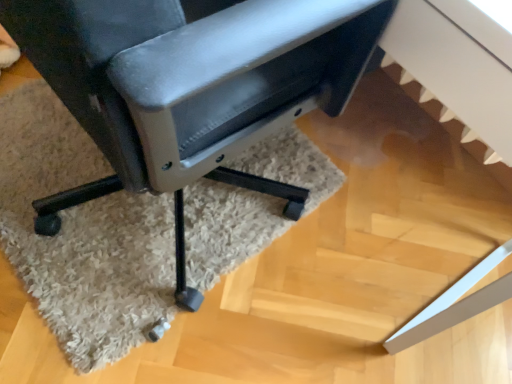
I want to click on matte black chair at center, so click(x=191, y=85).

What do you see at coordinates (191, 85) in the screenshot?
I see `matte black chair at center` at bounding box center [191, 85].

The width and height of the screenshot is (512, 384). What do you see at coordinates (85, 245) in the screenshot? I see `beige shaggy rug at lower center` at bounding box center [85, 245].

Identify the location of beige shaggy rug at lower center. The width and height of the screenshot is (512, 384). (85, 245).

At what (x,y) coordinates should I click in order to perform the action: click on matte black chair at center. Please return your answer as a coordinate pair (x, y). The image size is (512, 384). Looking at the image, I should click on (191, 85).

Which is more to the left, beige shaggy rug at lower center or matte black chair at center?

beige shaggy rug at lower center is more to the left.

Is the position of beige shaggy rug at lower center more distant than that of matte black chair at center?

Yes, it is behind matte black chair at center.

Is point (300, 142) positioned in front of point (100, 33)?

No, (300, 142) is behind (100, 33).

From the image's perspective, would you say beige shaggy rug at lower center is shown under matte black chair at center?

Yes.

Based on the photo, from a real-world perspective, does beige shaggy rug at lower center sit lower than matte black chair at center?

Yes.

Looking at their sizes, would you say beige shaggy rug at lower center is wider or thinner than matte black chair at center?

Considering their sizes, beige shaggy rug at lower center looks broader than matte black chair at center.

Considering the sizes of objects beige shaggy rug at lower center and matte black chair at center in the image provided, who is shorter, beige shaggy rug at lower center or matte black chair at center?

With less height is beige shaggy rug at lower center.

Looking at the image, does beige shaggy rug at lower center seem bigger or smaller compared to matte black chair at center?

Clearly, beige shaggy rug at lower center is smaller in size than matte black chair at center.

Can we say beige shaggy rug at lower center lies outside matte black chair at center?

That's correct, beige shaggy rug at lower center is outside of matte black chair at center.

Would you say beige shaggy rug at lower center is a long distance from matte black chair at center?

No, there isn't a large distance between beige shaggy rug at lower center and matte black chair at center.

Is beige shaggy rug at lower center facing towards matte black chair at center?

No, beige shaggy rug at lower center is not aimed at matte black chair at center.

How many degrees apart are the facing directions of beige shaggy rug at lower center and matte black chair at center?

The angular difference between beige shaggy rug at lower center and matte black chair at center is 5.94 degrees.

Where is `chair above the beige shaggy rug at lower center (from the image's perspective)`? The image size is (512, 384). chair above the beige shaggy rug at lower center (from the image's perspective) is located at coordinates (191, 85).

Is matte black chair at center at the left side of beige shaggy rug at lower center?

In fact, matte black chair at center is to the right of beige shaggy rug at lower center.

Which object is more forward, matte black chair at center or beige shaggy rug at lower center?

matte black chair at center is in front.

Which point is more distant from viewer, [282,43] or [15,246]?

The point [15,246] is farther from the camera.

From the image's perspective, is matte black chair at center located beneath beige shaggy rug at lower center?

Actually, matte black chair at center appears above beige shaggy rug at lower center in the image.

From a real-world perspective, relative to beige shaggy rug at lower center, is matte black chair at center vertically above or below?

From a real-world perspective, matte black chair at center is physically above beige shaggy rug at lower center.

Can you confirm if matte black chair at center is thinner than beige shaggy rug at lower center?

Yes.

Which of these two, matte black chair at center or beige shaggy rug at lower center, stands shorter?

Standing shorter between the two is beige shaggy rug at lower center.

Considering the sizes of matte black chair at center and beige shaggy rug at lower center in the image, is matte black chair at center bigger or smaller than beige shaggy rug at lower center?

matte black chair at center is bigger than beige shaggy rug at lower center.

Would you say beige shaggy rug at lower center is part of matte black chair at center's contents?

No.

Is matte black chair at center with beige shaggy rug at lower center?

They are not placed beside each other.

Is matte black chair at center positioned with its back to beige shaggy rug at lower center?

matte black chair at center is not turned away from beige shaggy rug at lower center.

Where is `chair lying above the beige shaggy rug at lower center (from the image's perspective)`? The height and width of the screenshot is (384, 512). chair lying above the beige shaggy rug at lower center (from the image's perspective) is located at coordinates (191, 85).

At what (x,y) coordinates should I click in order to perform the action: click on mat located below the matte black chair at center (from the image's perspective). Please return your answer as a coordinate pair (x, y). The height and width of the screenshot is (384, 512). Looking at the image, I should click on (85, 245).

This screenshot has height=384, width=512. What are the coordinates of `chair in front of the beige shaggy rug at lower center` in the screenshot? It's located at (191, 85).